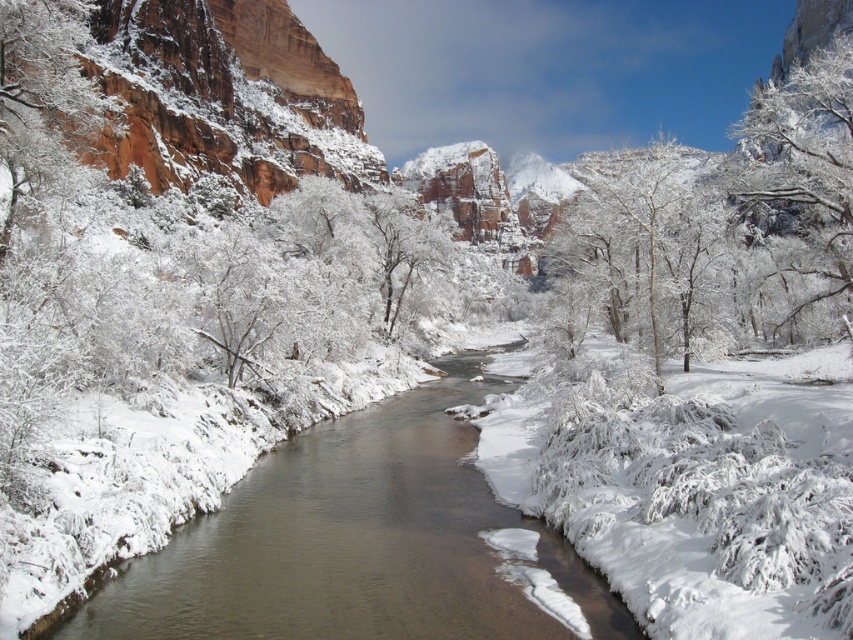
Who is positioned more to the right, white frosty tree at center or white frosty branches at upper right?

white frosty branches at upper right

Between point (674, 276) and point (824, 77), which one is positioned in front?

Point (674, 276) is more forward.

Is point (670, 182) less distant than point (804, 106)?

Yes, point (670, 182) is closer to viewer.

You are a GUI agent. You are given a task and a screenshot of the screen. Output one action in this format:
    pyautogui.click(x=<x>, y=<y>)
    Task: Click on the white frosty tree at center
    The width and height of the screenshot is (853, 640).
    Given the screenshot: What is the action you would take?
    pyautogui.click(x=646, y=248)

Who is positioned more to the left, brown smooth stream at center or white frosty tree at center?

Positioned to the left is brown smooth stream at center.

Which is more to the right, brown smooth stream at center or white frosty tree at center?

From the viewer's perspective, white frosty tree at center appears more on the right side.

What are the coordinates of `brown smooth stream at center` in the screenshot? It's located at (354, 541).

Which is more to the right, brown smooth stream at center or white frosty branches at upper right?

Positioned to the right is white frosty branches at upper right.

From the picture: Who is shorter, brown smooth stream at center or white frosty branches at upper right?

Standing shorter between the two is brown smooth stream at center.

Measure the distance between brown smooth stream at center and camera.

brown smooth stream at center is 48.25 meters away from camera.

Where is `brown smooth stream at center`? This screenshot has width=853, height=640. brown smooth stream at center is located at coordinates (x=354, y=541).